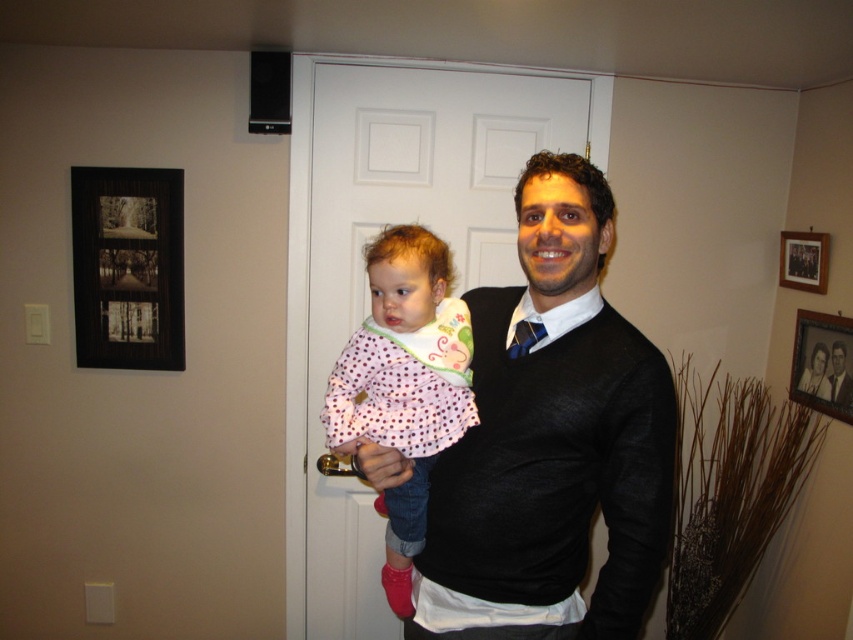
You are a delivery person who needs to hang a 6 inch wide package between the wooden framed photo at upper right and the wooden picture frame at upper right. Can you fit it there?

The wooden framed photo at upper right and wooden picture frame at upper right are 7.50 inches apart. Since the package is 6 inches wide, it can fit between them as there is enough space.

You are a delivery person who needs to place a small package between the pink polka dot fabric at center and the wooden picture frame at upper right. The package requires 3 feet of space. Can you fit it there?

The distance between the pink polka dot fabric at center and the wooden picture frame at upper right is 4.47 feet, which is more than enough to accommodate the 3 feet required for the package. Yes, you can fit the package there.